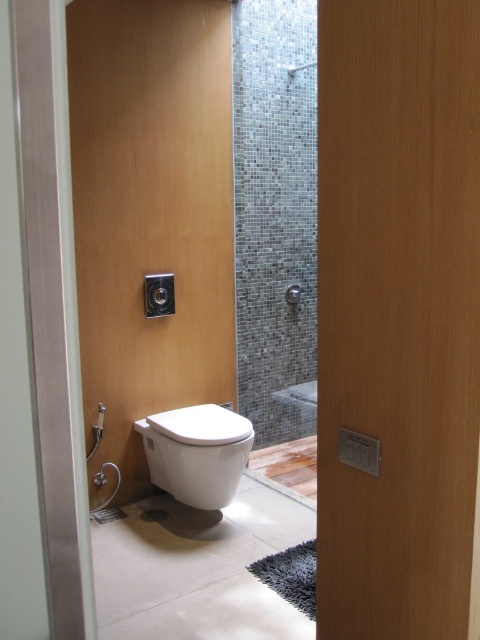
Is white glossy toilet at center below matte gray tile shower at upper center?

Answer: Correct, white glossy toilet at center is located below matte gray tile shower at upper center.

How distant is white glossy toilet at center from matte gray tile shower at upper center?

They are 1.33 meters apart.

I want to click on white glossy toilet at center, so click(151, 214).

Is white glossy toilet at center thinner than white glossy toilet at lower left?

Incorrect, white glossy toilet at center's width is not less than white glossy toilet at lower left's.

Identify the location of white glossy toilet at center. (151, 214).

Which of these two, wooden door at center or matte gray tile shower at upper center, stands taller?

wooden door at center

Is point (436, 308) more distant than point (312, 67)?

No, (436, 308) is closer to viewer.

You are a GUI agent. You are given a task and a screenshot of the screen. Output one action in this format:
    pyautogui.click(x=<x>, y=<y>)
    Task: Click on the wooden door at center
    The image size is (480, 640).
    Given the screenshot: What is the action you would take?
    pyautogui.click(x=397, y=314)